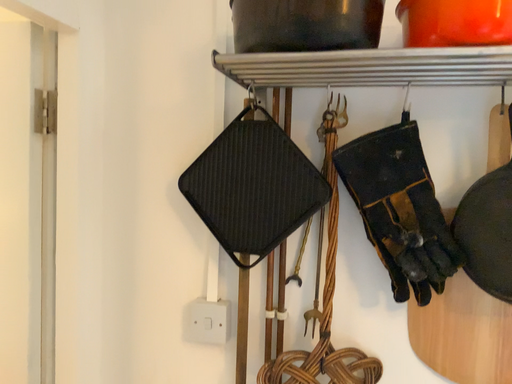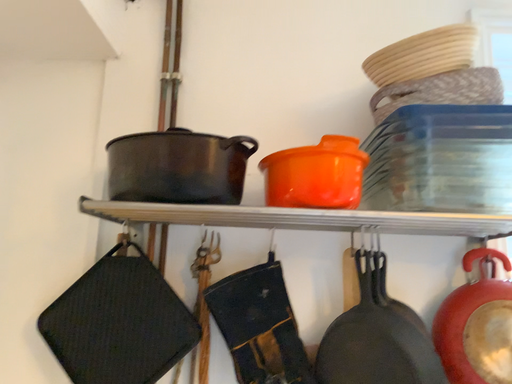
Question: Which way did the camera rotate in the video?

Choices:
 (A) rotated downward
 (B) rotated upward

Answer: (B)